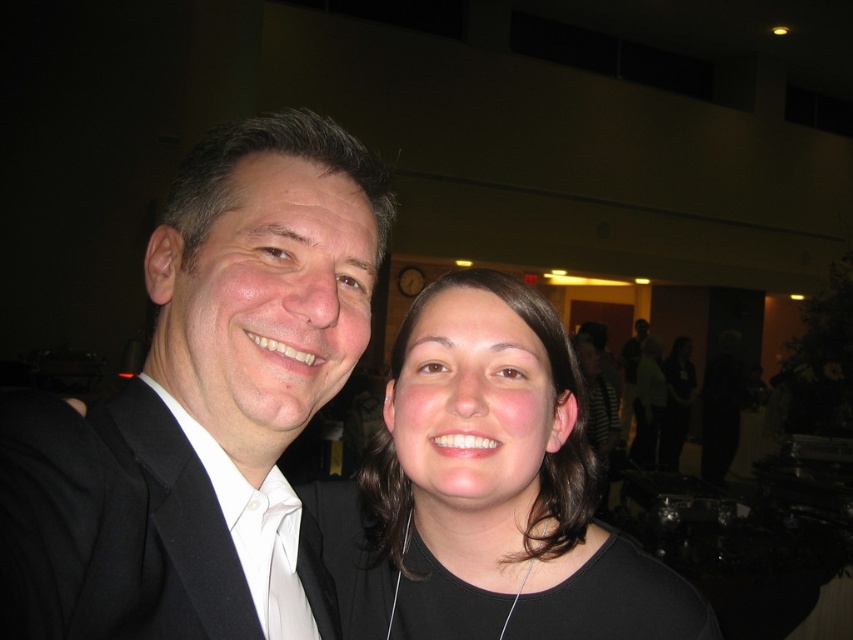
You are a photographer adjusting your camera settings to focus on both the black matte hair at center and the white satin tie at center. Which object should you focus on first to ensure proper depth of field?

The black matte hair at center is closer to the viewer than the white satin tie at center, so you should focus on the black matte hair at center first to ensure proper depth of field.

You are a photographer adjusting the camera focus. The camera has a focus point at coordinate point 0.767, 0.572. Which object from the scene should you focus on to capture the black matte hair at center clearly?

The black matte hair at center is located at point (x=486, y=490), so focusing the camera on that coordinate will ensure the black matte hair at center is in clear focus.

You are an event photographer trying to frame a shot. You notice the black matte suit at left and the black matte hair at center. Which object is narrower in width?

The black matte suit at left is thinner than the black matte hair at center, so the black matte suit at left is narrower in width.